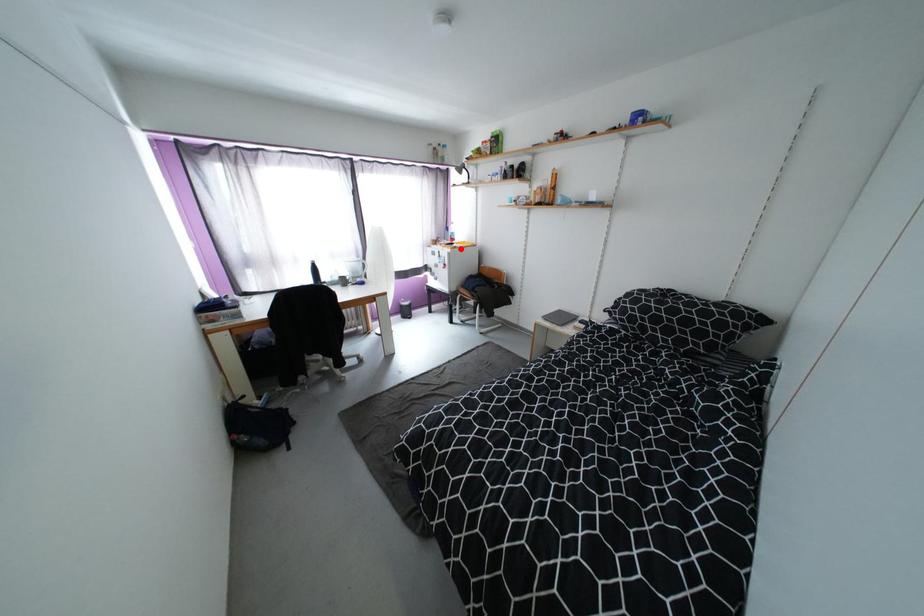
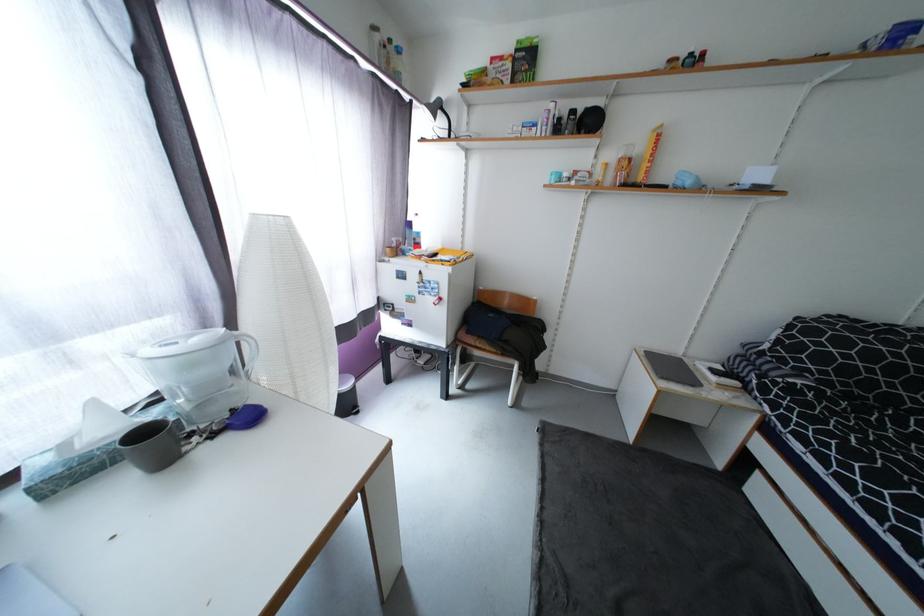
In the second image, find the point that corresponds to the highlighted location in the first image.

(460, 264)